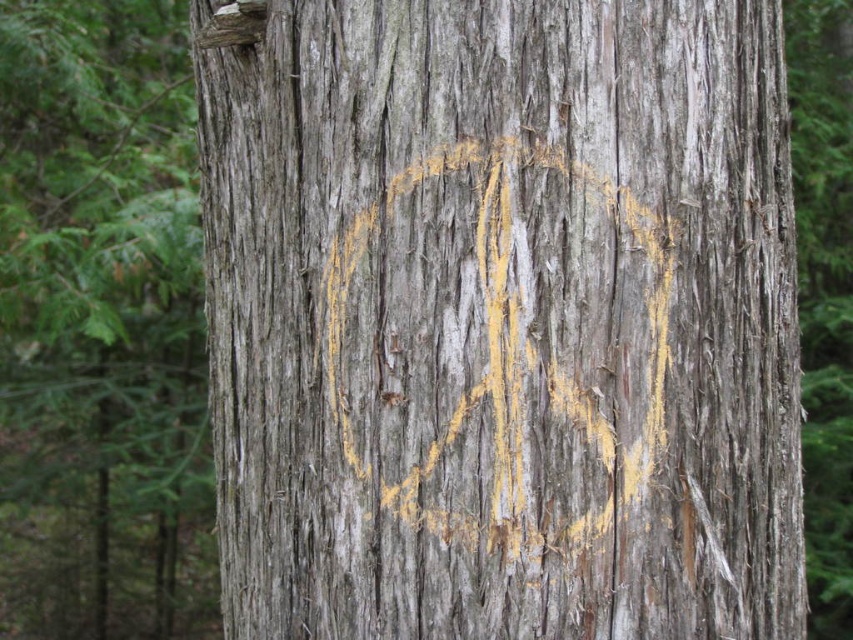
Question: Among these objects, which one is nearest to the camera?

Choices:
 (A) yellowish-brown wood at center
 (B) gray rough bark tree trunk at center

Answer: (A)

Question: Among these points, which one is nearest to the camera?

Choices:
 (A) (115, 304)
 (B) (747, 104)

Answer: (B)

Question: Can you confirm if yellowish-brown wood at center is positioned to the left of gray rough bark tree trunk at center?

Choices:
 (A) no
 (B) yes

Answer: (A)

Question: Does yellowish-brown wood at center lie in front of gray rough bark tree trunk at center?

Choices:
 (A) yes
 (B) no

Answer: (A)

Question: Observing the image, what is the correct spatial positioning of yellowish-brown wood at center in reference to gray rough bark tree trunk at center?

Choices:
 (A) right
 (B) left

Answer: (A)